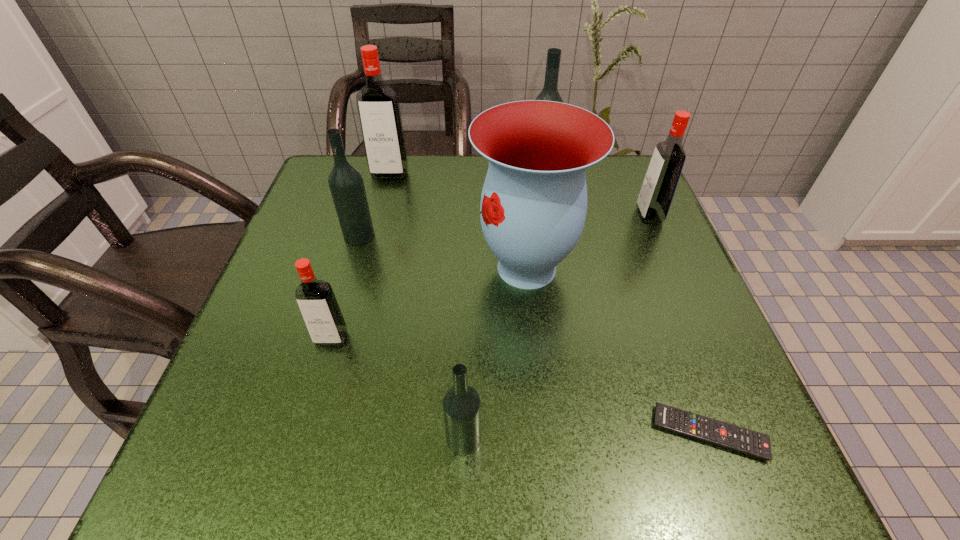
Where is `red vodka that stands as the closest to the vase`? This screenshot has width=960, height=540. red vodka that stands as the closest to the vase is located at coordinates (660, 182).

Image resolution: width=960 pixels, height=540 pixels. In order to click on vacant area that satisfies the following two spatial constraints: 1. on the front and back of the second biggest red vodka; 2. on the front and back of the second nearest vodka in this screenshot , I will do `click(702, 339)`.

Identify the location of free location that satisfies the following two spatial constraints: 1. on the front and back of the nearest vodka; 2. on the left side of the farthest red vodka. The image size is (960, 540). (322, 438).

In order to click on free space that satisfies the following two spatial constraints: 1. on the front and back of the second biggest red vodka; 2. on the front and back of the smallest red vodka in this screenshot , I will do `click(702, 339)`.

Where is `blank area in the image that satisfies the following two spatial constraints: 1. on the back side of the biggest black vodka; 2. on the left side of the second biggest black vodka`? blank area in the image that satisfies the following two spatial constraints: 1. on the back side of the biggest black vodka; 2. on the left side of the second biggest black vodka is located at coordinates (376, 178).

Where is `free space that satisfies the following two spatial constraints: 1. on the back side of the biggest black vodka; 2. on the right side of the vase`? free space that satisfies the following two spatial constraints: 1. on the back side of the biggest black vodka; 2. on the right side of the vase is located at coordinates click(517, 178).

The width and height of the screenshot is (960, 540). I want to click on vacant space that satisfies the following two spatial constraints: 1. on the front side of the shortest object; 2. on the left side of the leftmost black vodka, so (301, 433).

Find the location of `free space that satisfies the following two spatial constraints: 1. on the front and back of the second nearest vodka; 2. on the left side of the smallest black vodka`. free space that satisfies the following two spatial constraints: 1. on the front and back of the second nearest vodka; 2. on the left side of the smallest black vodka is located at coordinates (302, 438).